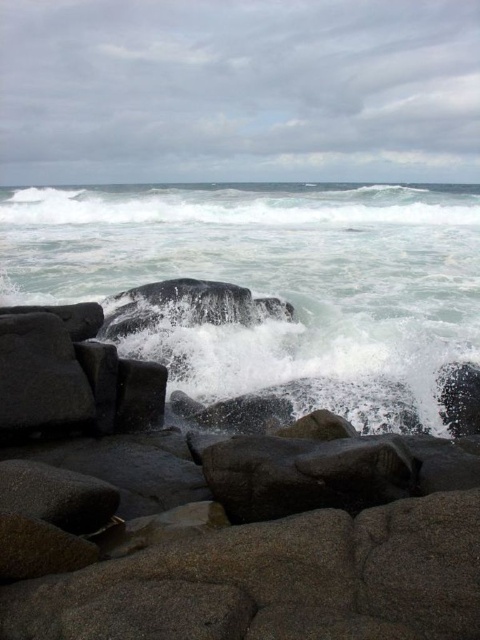
Is point (75, 83) positioned in front of point (370, 392)?

No, it is not.

Can you confirm if smooth granite rocks at lower center is bigger than white frothy water at center?

Yes.

Which is in front, point (463, 32) or point (168, 196)?

Point (168, 196)

Identify the location of smooth granite rocks at lower center. Image resolution: width=480 pixels, height=640 pixels. (239, 90).

From the picture: Does gray granite rocks at lower center appear on the right side of smooth granite rocks at lower center?

Correct, you'll find gray granite rocks at lower center to the right of smooth granite rocks at lower center.

Can you confirm if gray granite rocks at lower center is shorter than smooth granite rocks at lower center?

Correct, gray granite rocks at lower center is not as tall as smooth granite rocks at lower center.

Locate an element on the screen. gray granite rocks at lower center is located at coordinates (214, 509).

Is point (420, 266) farther from camera compared to point (263, 192)?

That is False.

Does white frothy water at center appear on the right side of white frothy wave at upper center?

Incorrect, white frothy water at center is not on the right side of white frothy wave at upper center.

Is point (447, 225) positioned after point (432, 212)?

That is False.

Find the location of a particular element. white frothy water at center is located at coordinates (273, 284).